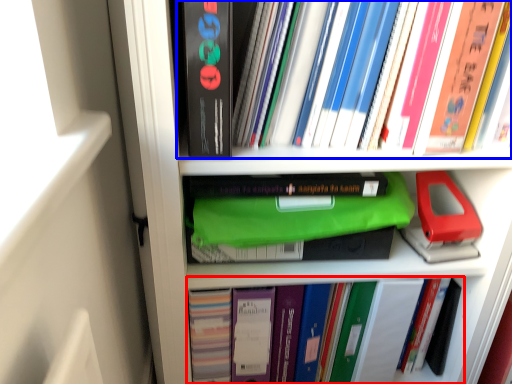
Question: Among these objects, which one is farthest to the camera, book (highlighted by a red box) or book (highlighted by a blue box)?

Choices:
 (A) book
 (B) book

Answer: (A)